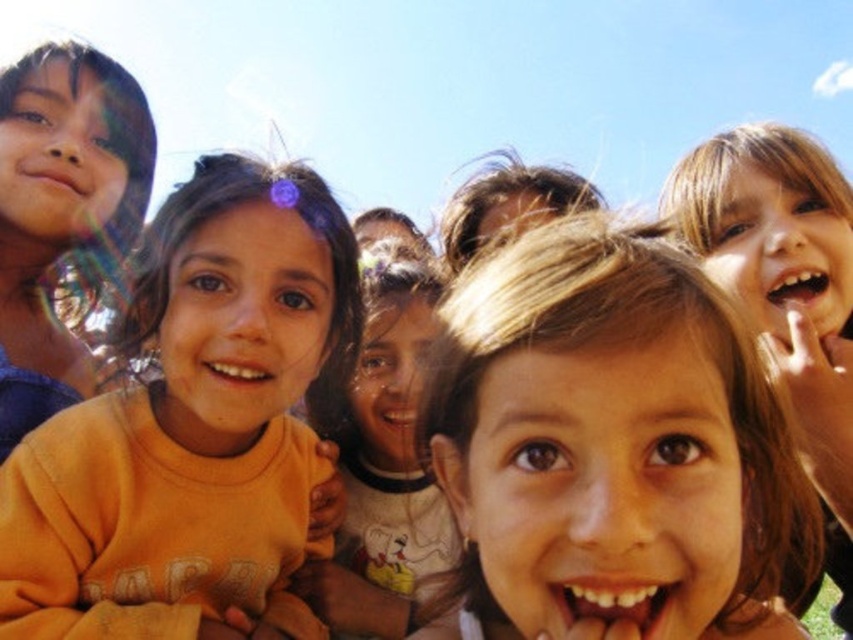
Measure the distance between blonde hair at center and camera.

blonde hair at center and camera are 78.04 centimeters apart.

Is blonde hair at center taller than orange cotton shirt at center?

No, blonde hair at center is not taller than orange cotton shirt at center.

This screenshot has width=853, height=640. What do you see at coordinates (610, 442) in the screenshot?
I see `blonde hair at center` at bounding box center [610, 442].

Identify the location of blonde hair at center. This screenshot has height=640, width=853. tap(610, 442).